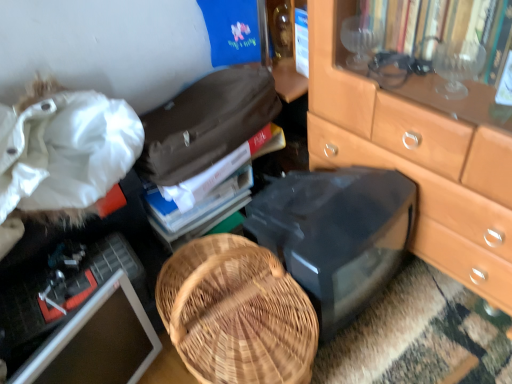
What do you see at coordinates (97, 342) in the screenshot? The height and width of the screenshot is (384, 512). I see `matte black computer monitor at lower left` at bounding box center [97, 342].

The height and width of the screenshot is (384, 512). In order to click on black plastic desktop at center in this screenshot , I will do `click(336, 234)`.

Can you tell me how much black plastic desktop at center and matte black computer monitor at lower left differ in facing direction?

There is a 20.1-degree angle between the facing directions of black plastic desktop at center and matte black computer monitor at lower left.

Based on the photo, is black plastic desktop at center facing away from matte black computer monitor at lower left?

No, matte black computer monitor at lower left is not at the back of black plastic desktop at center.

Measure the distance from black plastic desktop at center to matte black computer monitor at lower left.

black plastic desktop at center and matte black computer monitor at lower left are 18.10 inches apart from each other.

Which of these two, black plastic desktop at center or matte black computer monitor at lower left, is bigger?

black plastic desktop at center.

Is hardcover book at center positioned with its back to matte black computer monitor at lower left?

That's not correct — hardcover book at center is not looking away from matte black computer monitor at lower left.

Is hardcover book at center to the left or to the right of matte black computer monitor at lower left in the image?

Based on their positions, hardcover book at center is located to the right of matte black computer monitor at lower left.

Does hardcover book at center lie behind matte black computer monitor at lower left?

Yes, it is.

Does hardcover book at center come behind white fabric at upper left?

Yes, hardcover book at center is further from the viewer.

In the scene shown: Which is correct: hardcover book at center is inside white fabric at upper left, or outside of it?

hardcover book at center is not inside white fabric at upper left, it's outside.

Is hardcover book at center placed right next to white fabric at upper left?

hardcover book at center and white fabric at upper left are clearly separated.

Based on the photo, in terms of width, does hardcover book at center look wider or thinner when compared to white fabric at upper left?

Considering their sizes, hardcover book at center looks slimmer than white fabric at upper left.

From a real-world perspective, relative to white fabric at upper left, is black plastic desktop at center vertically above or below?

In terms of real-world spatial position, black plastic desktop at center is below white fabric at upper left.

Is white fabric at upper left at the back of black plastic desktop at center?

No, black plastic desktop at center's orientation is not away from white fabric at upper left.

Which is more to the right, black plastic desktop at center or white fabric at upper left?

Positioned to the right is black plastic desktop at center.

Is black plastic desktop at center positioned in front of white fabric at upper left?

No.

Does point (37, 18) appear closer or farther from the camera than point (119, 313)?

Point (37, 18) appears to be farther away from the viewer than point (119, 313).

Would you say matte black computer monitor at lower left is part of white fabric at upper left's contents?

Yes, white fabric at upper left is surrounding matte black computer monitor at lower left.

From a real-world perspective, who is located higher, white fabric at upper left or matte black computer monitor at lower left?

In real-world perspective, white fabric at upper left is above.

Is hardcover book at center touching black plastic desktop at center?

hardcover book at center and black plastic desktop at center are clearly separated.

Considering the sizes of objects hardcover book at center and black plastic desktop at center in the image provided, who is smaller, hardcover book at center or black plastic desktop at center?

hardcover book at center is smaller.

How different are the orientations of hardcover book at center and black plastic desktop at center in degrees?

There is a 5.05-degree angle between the facing directions of hardcover book at center and black plastic desktop at center.

Which of these two, hardcover book at center or black plastic desktop at center, stands shorter?

hardcover book at center.

Is matte black computer monitor at lower left placed right next to white fabric at upper left?

No.

Is matte black computer monitor at lower left positioned with its back to white fabric at upper left?

Yes.

Would you say matte black computer monitor at lower left is to the left or to the right of white fabric at upper left in the picture?

Based on their positions, matte black computer monitor at lower left is located to the right of white fabric at upper left.

In terms of size, does matte black computer monitor at lower left appear bigger or smaller than white fabric at upper left?

matte black computer monitor at lower left is smaller than white fabric at upper left.

The width and height of the screenshot is (512, 384). Find the location of `desktop to the right of matte black computer monitor at lower left`. desktop to the right of matte black computer monitor at lower left is located at coordinates (336, 234).

Where is `book that appears above the matte black computer monitor at lower left (from the image's perspective)`? This screenshot has width=512, height=384. book that appears above the matte black computer monitor at lower left (from the image's perspective) is located at coordinates (221, 169).

Consider the image. From the image, which object appears to be nearer to hardcover book at center, black plastic desktop at center or matte black computer monitor at lower left?

black plastic desktop at center is closer to hardcover book at center.

Based on their spatial positions, is hardcover book at center or white fabric at upper left closer to matte black computer monitor at lower left?

The object closer to matte black computer monitor at lower left is hardcover book at center.

Considering their positions, is black plastic desktop at center positioned closer to white fabric at upper left than matte black computer monitor at lower left?

black plastic desktop at center is positioned closer to the anchor white fabric at upper left.

Considering their positions, is hardcover book at center positioned further to white fabric at upper left than black plastic desktop at center?

black plastic desktop at center.

Which object lies nearer to the anchor point matte black computer monitor at lower left, hardcover book at center or black plastic desktop at center?

hardcover book at center is closer to matte black computer monitor at lower left.

Which object lies further to the anchor point white fabric at upper left, matte black computer monitor at lower left or hardcover book at center?

Based on the image, matte black computer monitor at lower left appears to be further to white fabric at upper left.

Based on their spatial positions, is matte black computer monitor at lower left or white fabric at upper left further from black plastic desktop at center?

The object further to black plastic desktop at center is matte black computer monitor at lower left.

Based on their spatial positions, is black plastic desktop at center or hardcover book at center closer to white fabric at upper left?

The object closer to white fabric at upper left is hardcover book at center.

Find the location of `book between white fabric at upper left and black plastic desktop at center in the horizontal direction`. book between white fabric at upper left and black plastic desktop at center in the horizontal direction is located at coordinates (221, 169).

This screenshot has width=512, height=384. What are the coordinates of `book between matte black computer monitor at lower left and black plastic desktop at center in the horizontal direction` in the screenshot? It's located at (221, 169).

You are a GUI agent. You are given a task and a screenshot of the screen. Output one action in this format:
    pyautogui.click(x=<x>, y=<y>)
    Task: Click on the computer monitor between white fabric at upper left and black plastic desktop at center from left to right
    
    Given the screenshot: What is the action you would take?
    pyautogui.click(x=97, y=342)

Image resolution: width=512 pixels, height=384 pixels. Identify the location of computer monitor between white fabric at upper left and hardcover book at center along the z-axis. (97, 342).